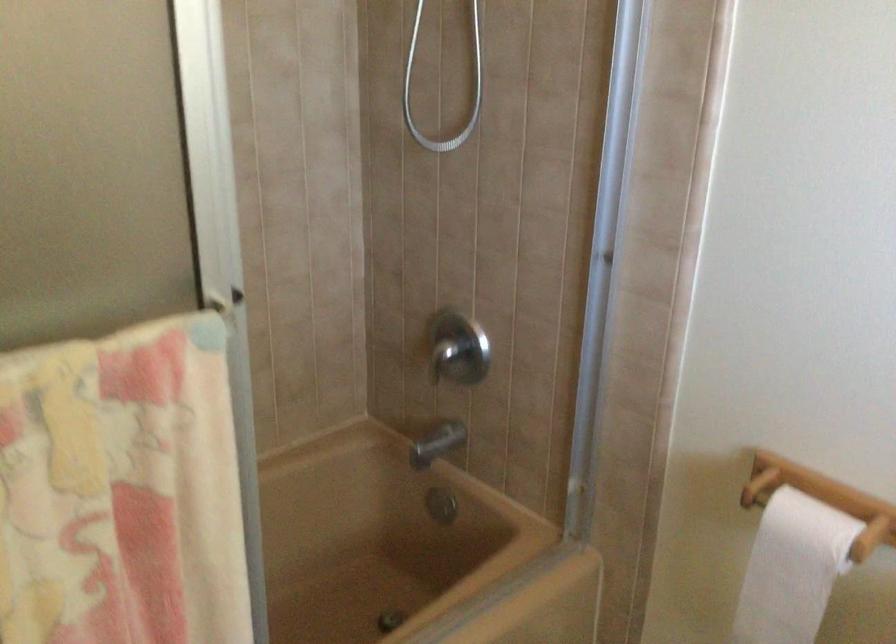
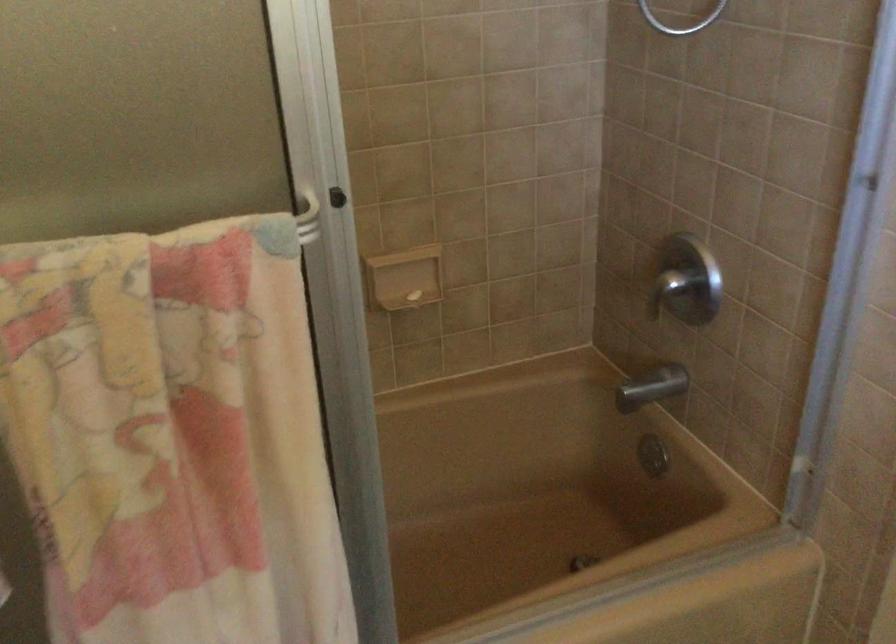
Question: The camera is either moving clockwise (left) or counter-clockwise (right) around the object. The first image is from the beginning of the video and the second image is from the end. Is the camera moving left or right when shooting the video?

Choices:
 (A) Left
 (B) Right

Answer: (B)